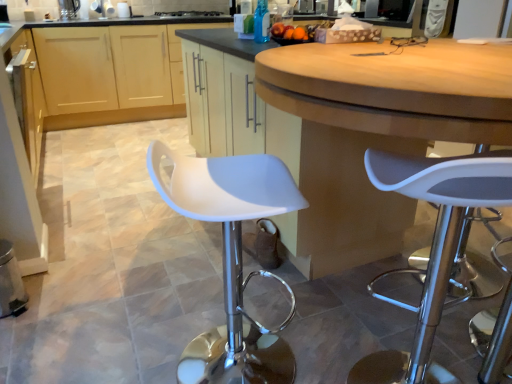
You are a GUI agent. You are given a task and a screenshot of the screen. Output one action in this format:
    pyautogui.click(x=<x>, y=<y>)
    Task: Click on the vacant space situated on the left part of white plastic stool at center
    This screenshot has width=512, height=384.
    Given the screenshot: What is the action you would take?
    pyautogui.click(x=130, y=343)